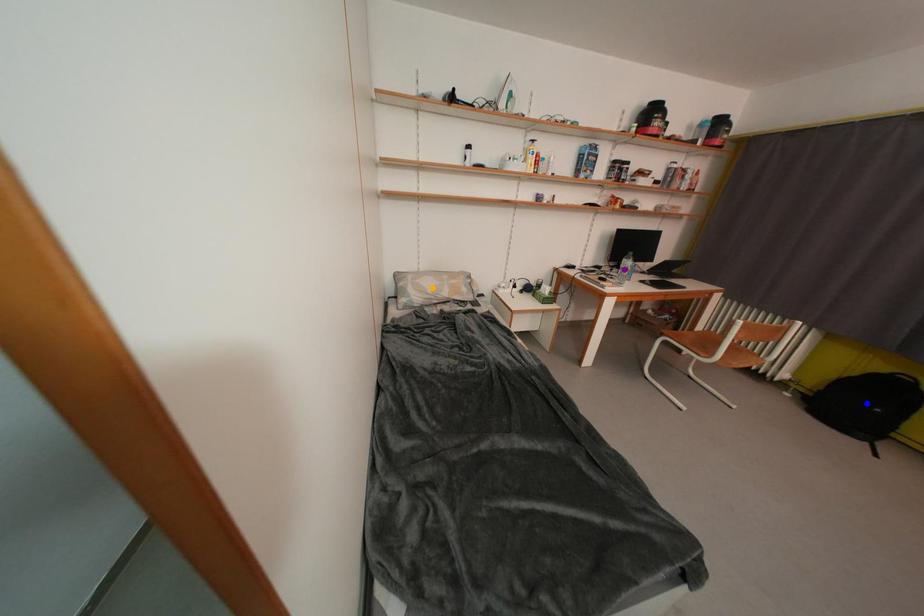
Consider the image. Order these from nearest to farthest:
1. purple point
2. orange point
3. blue point

blue point, orange point, purple point